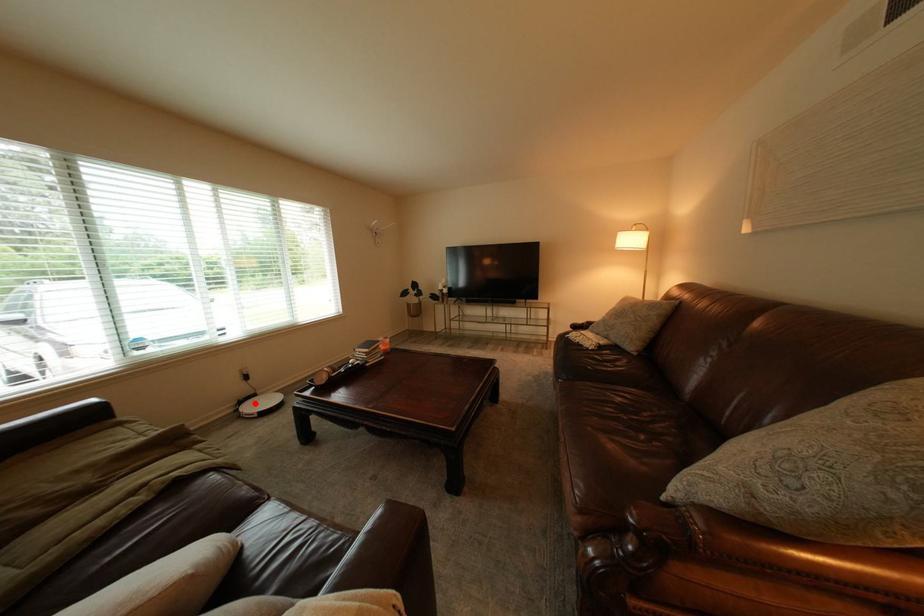
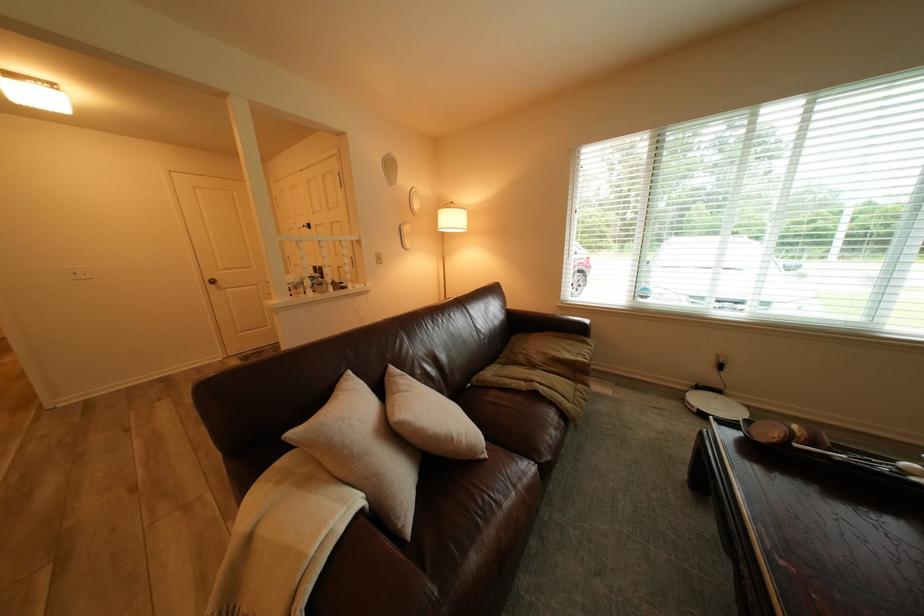
The point at the highlighted location is marked in the first image. Where is the corresponding point in the second image?

(712, 389)